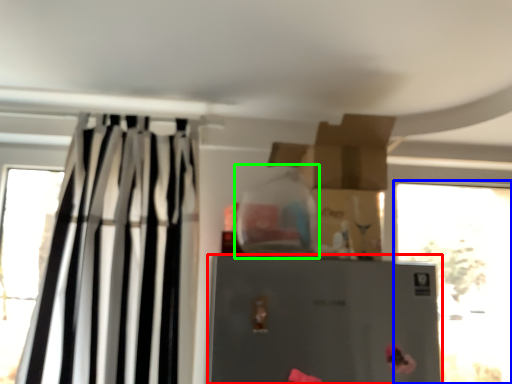
Question: Which object is positioned farthest from refrigerator (highlighted by a red box)? Select from window (highlighted by a blue box) and bottle (highlighted by a green box).

Choices:
 (A) window
 (B) bottle

Answer: (A)